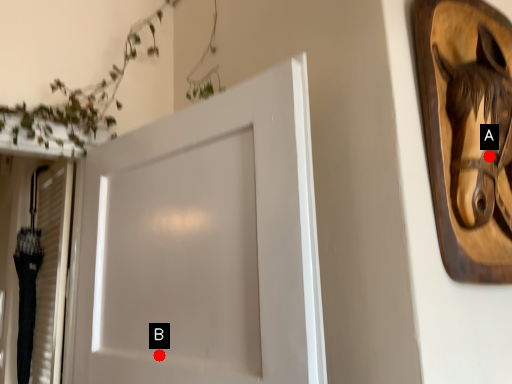
Question: Two points are circled on the image, labeled by A and B beside each circle. Among these points, which one is farthest from the camera?

Choices:
 (A) A is further
 (B) B is further

Answer: (B)